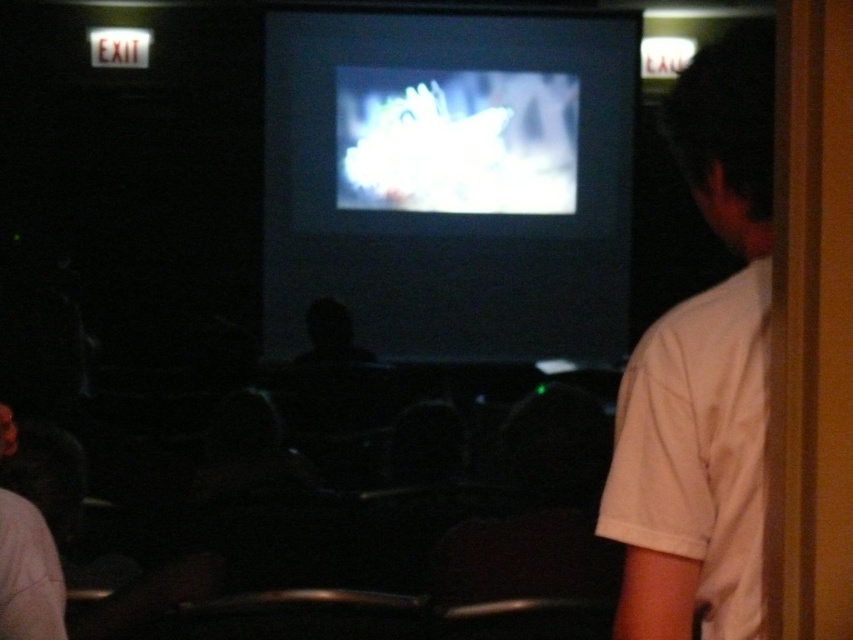
Can you confirm if matte black screen at center is bigger than white cotton shirt at right?

Yes.

Which is behind, point (491, 355) or point (685, 614)?

The point (491, 355) is behind.

Where is `matte black screen at center`? This screenshot has width=853, height=640. matte black screen at center is located at coordinates (450, 180).